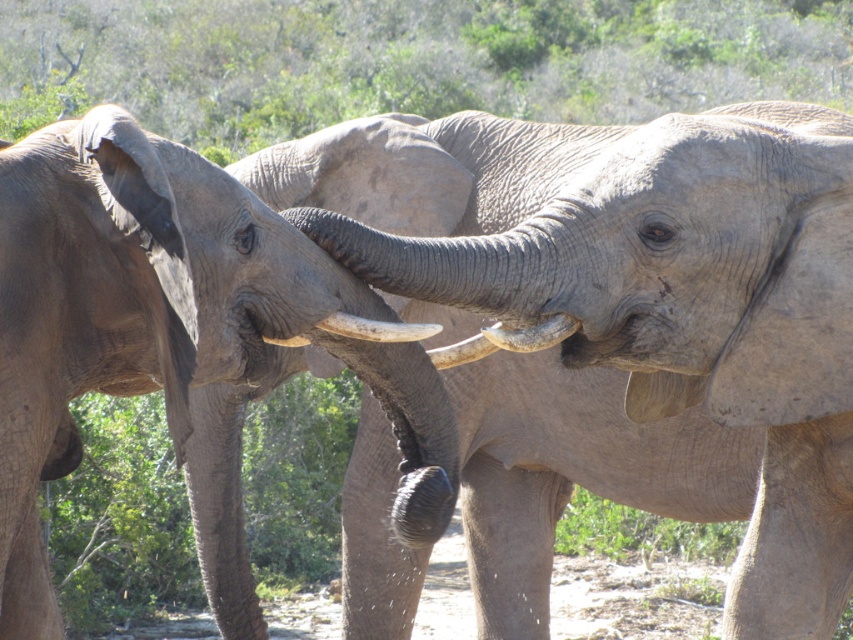
Question: Does gray matte tusk at center have a lesser width compared to white smooth tusk at center?

Choices:
 (A) yes
 (B) no

Answer: (B)

Question: Can you confirm if gray matte tusk at center is thinner than smooth ivory tusk at center?

Choices:
 (A) yes
 (B) no

Answer: (B)

Question: Which point is farther to the camera?

Choices:
 (A) gray matte tusk at center
 (B) gray textured elephant at center
 (C) white smooth tusk at center

Answer: (B)

Question: Does gray textured elephant at left appear on the left side of smooth ivory tusk at center?

Choices:
 (A) yes
 (B) no

Answer: (A)

Question: Which object appears farthest from the camera in this image?

Choices:
 (A) smooth ivory tusk at center
 (B) white smooth tusk at center
 (C) gray matte tusk at center

Answer: (A)

Question: Among these points, which one is farthest from the camera?

Choices:
 (A) (466, 349)
 (B) (379, 330)
 (C) (305, 252)
 (D) (560, 170)

Answer: (D)